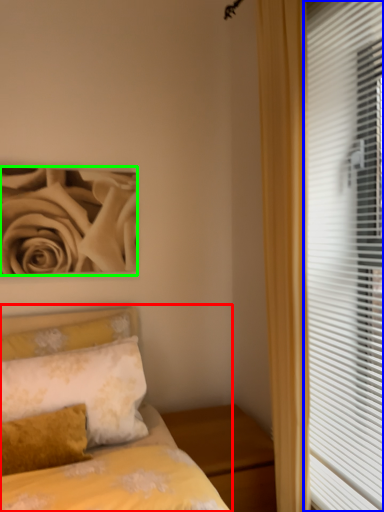
Question: Which object is positioned closest to bed (highlighted by a red box)? Select from window blind (highlighted by a blue box) and rose (highlighted by a green box).

Choices:
 (A) window blind
 (B) rose

Answer: (A)